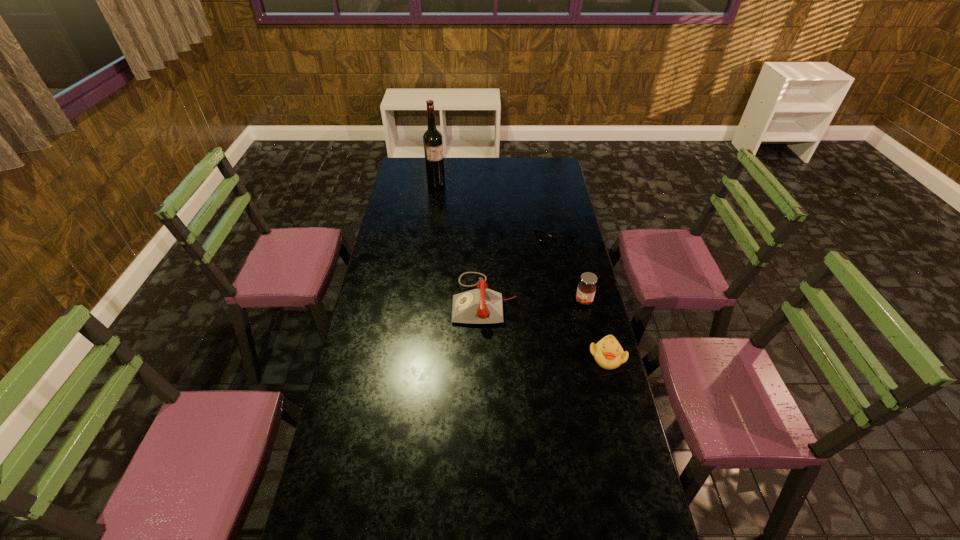
This screenshot has width=960, height=540. I want to click on the fourth object from right to left, so click(x=482, y=305).

Identify the location of the nearest object. (608, 353).

I want to click on the farthest object, so click(x=432, y=139).

The image size is (960, 540). In order to click on the leftmost object in this screenshot , I will do `click(432, 139)`.

Find the location of a particular element. spectacles is located at coordinates (541, 236).

At what (x,y) coordinates should I click in order to perform the action: click on the second farthest object. Please return your answer as a coordinate pair (x, y). Looking at the image, I should click on (541, 236).

Where is `jam`? jam is located at coordinates (586, 289).

Where is `free space located on the dial of the fourth object from right to left`? The image size is (960, 540). free space located on the dial of the fourth object from right to left is located at coordinates (441, 299).

This screenshot has width=960, height=540. I want to click on blank space located on the dial of the fourth object from right to left, so click(x=388, y=299).

At what (x,y) coordinates should I click in order to perform the action: click on free space located on the dial of the fourth object from right to left. Please return your answer as a coordinate pair (x, y). Looking at the image, I should click on (370, 299).